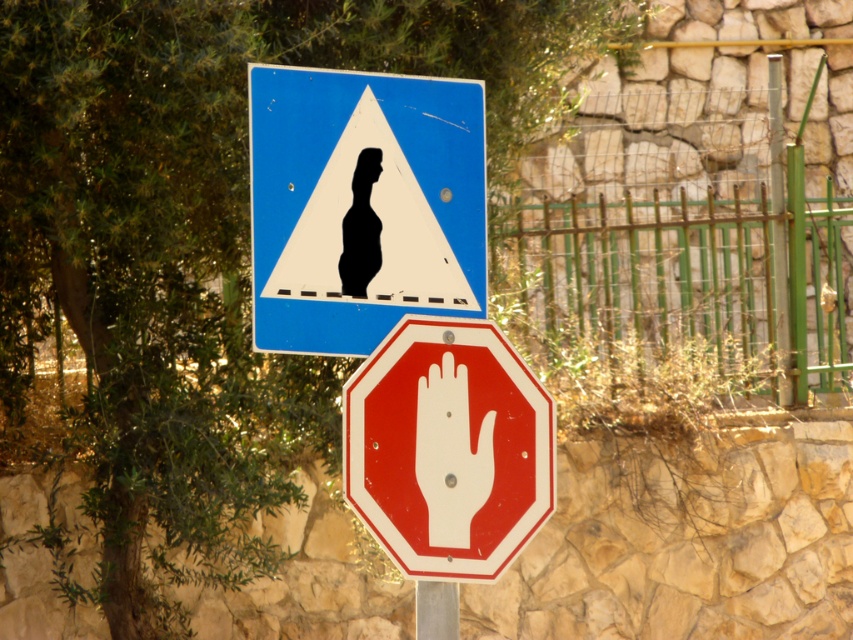
You are a delivery driver who needs to know the size of the traffic signs for a report. Which object has a larger width between the blue glossy triangle at upper center and the red glossy octagon at center?

The blue glossy triangle at upper center has a larger width than the red glossy octagon at center.